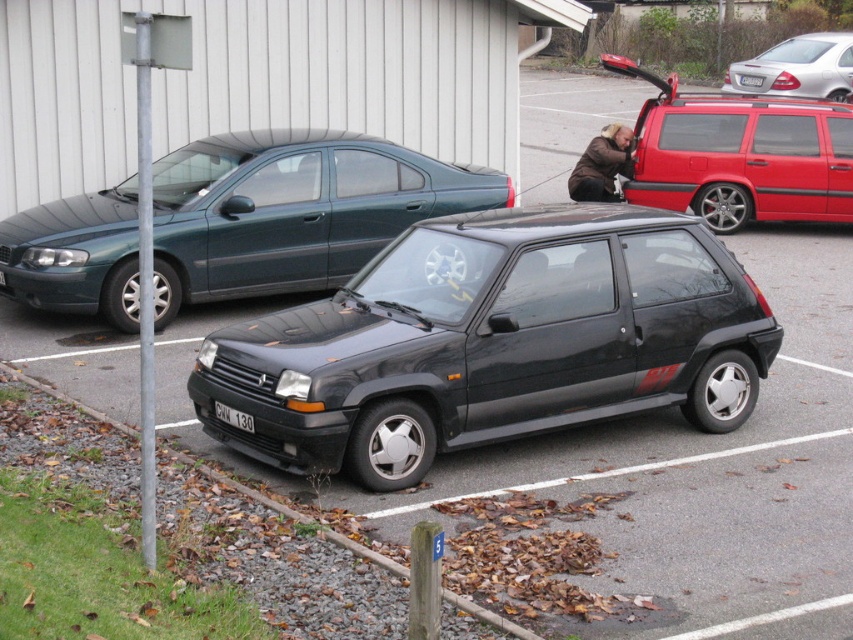
Which of these two, metallic red suv at upper right or gravel at lower left, stands shorter?

gravel at lower left

Is point (779, 116) behind point (381, 561)?

Yes, it is behind point (381, 561).

The height and width of the screenshot is (640, 853). In order to click on metallic red suv at upper right in this screenshot , I will do `click(740, 154)`.

Does metallic red suv at upper right have a lesser width compared to silver metallic sedan at upper right?

No.

Describe the element at coordinates (740, 154) in the screenshot. I see `metallic red suv at upper right` at that location.

At what (x,y) coordinates should I click in order to perform the action: click on metallic red suv at upper right. Please return your answer as a coordinate pair (x, y). The image size is (853, 640). Looking at the image, I should click on (740, 154).

Which is behind, point (850, 76) or point (135, 438)?

Point (850, 76)

Which is behind, point (782, 70) or point (180, 451)?

Positioned behind is point (782, 70).

I want to click on silver metallic sedan at upper right, so click(x=798, y=67).